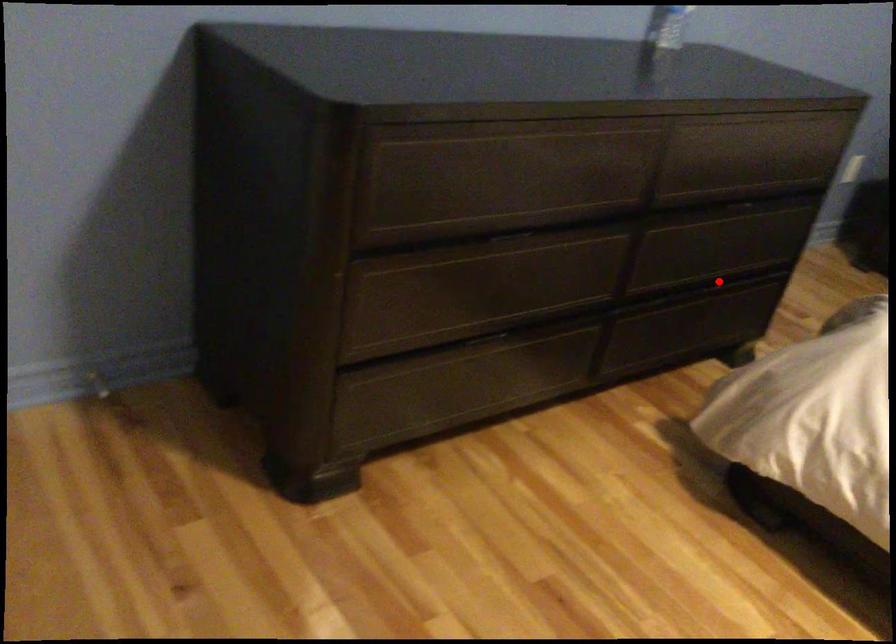
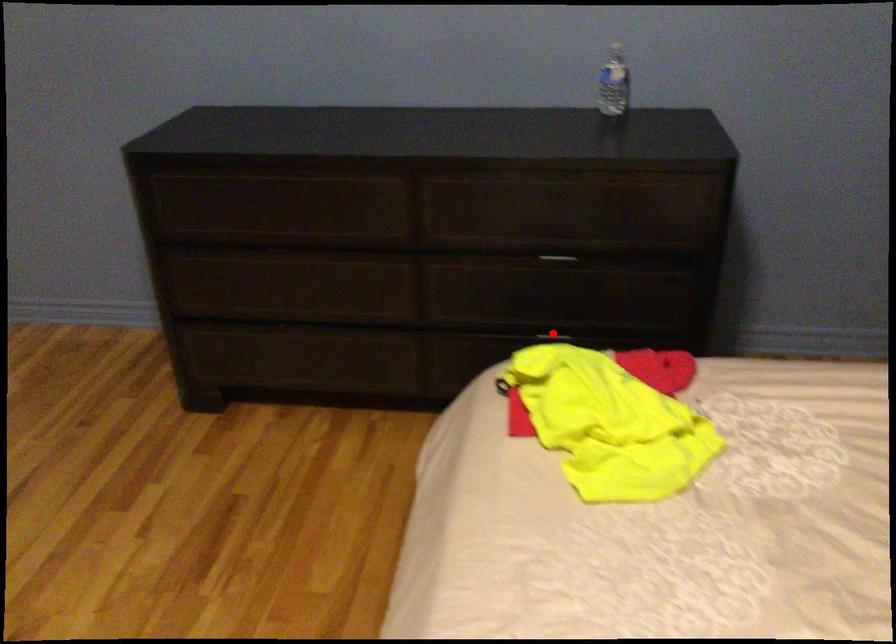
I am providing you with two images of the same scene from different viewpoints. A red point is marked on the first image and another point is marked on the second image. Are the points marked in image1 and image2 representing the same 3D position?

Yes